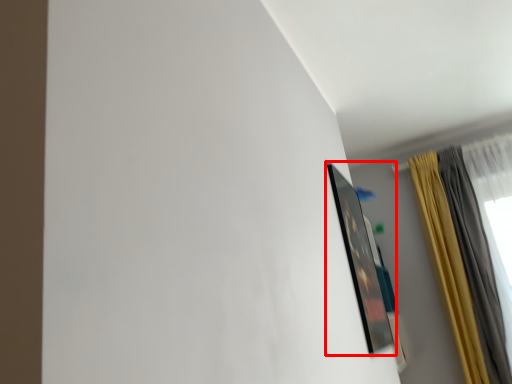
Question: Where is picture frame (annotated by the red box) located in relation to curtain in the image?

Choices:
 (A) right
 (B) left

Answer: (B)